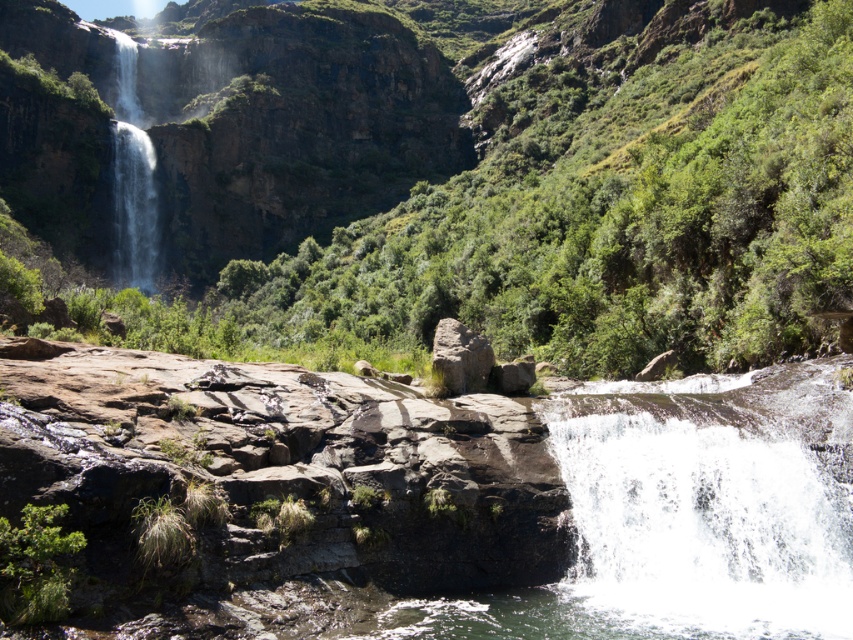
Between white frothy water at lower right and rusty rock at center, which one is positioned higher?

rusty rock at center is above.

From the picture: Which is more to the left, white frothy water at lower right or rusty rock at center?

Positioned to the left is rusty rock at center.

What do you see at coordinates (699, 531) in the screenshot? I see `white frothy water at lower right` at bounding box center [699, 531].

Image resolution: width=853 pixels, height=640 pixels. In order to click on white frothy water at lower right in this screenshot , I will do `click(699, 531)`.

Does white frothy water at upper left have a larger size compared to rusty rock at center?

Indeed, white frothy water at upper left has a larger size compared to rusty rock at center.

Is white frothy water at upper left to the right of rusty rock at center from the viewer's perspective?

Incorrect, white frothy water at upper left is not on the right side of rusty rock at center.

Looking at this image, who is more distant from viewer, (x=137, y=211) or (x=488, y=371)?

Point (x=137, y=211)

The image size is (853, 640). In order to click on white frothy water at upper left in this screenshot , I will do `click(132, 177)`.

Is white frothy water at lower right to the left of white frothy water at upper left from the viewer's perspective?

Incorrect, white frothy water at lower right is not on the left side of white frothy water at upper left.

Is white frothy water at lower right positioned at the back of white frothy water at upper left?

That is False.

What are the coordinates of `white frothy water at lower right` in the screenshot? It's located at (699, 531).

What are the coordinates of `white frothy water at lower right` in the screenshot? It's located at (699, 531).